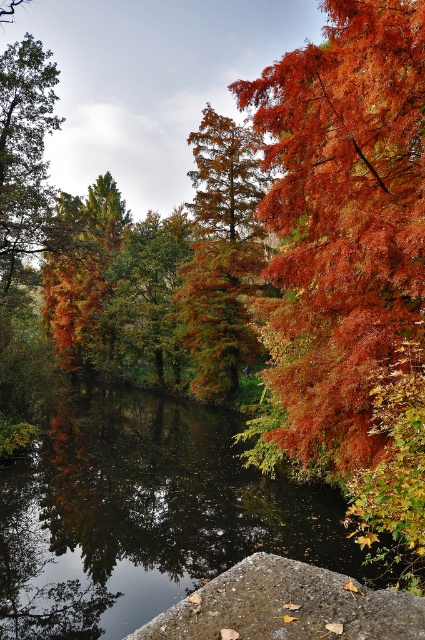
Between shiny orange leaves at right and smooth dark water at center, which one is positioned lower?

smooth dark water at center

Is point (377, 326) positioned after point (112, 404)?

No, (377, 326) is in front of (112, 404).

This screenshot has width=425, height=640. I want to click on shiny orange leaves at right, so click(342, 221).

Measure the distance between orange matte tree at center and camera.

The distance of orange matte tree at center from camera is 29.37 meters.

Which is above, orange matte tree at center or green matte tree at left?

green matte tree at left is higher up.

Does point (198, 381) come in front of point (31, 122)?

No.

This screenshot has width=425, height=640. I want to click on orange matte tree at center, so click(221, 253).

Is point (14, 490) positioned after point (48, 216)?

That is False.

Does smooth dark water at center appear on the right side of green matte tree at left?

Indeed, smooth dark water at center is positioned on the right side of green matte tree at left.

Is point (153, 557) farther from camera compared to point (5, 262)?

No.

You are a GUI agent. You are given a task and a screenshot of the screen. Output one action in this format:
    pyautogui.click(x=<x>, y=<y>)
    Task: Click on the smooth dark water at center
    This screenshot has width=425, height=640.
    Given the screenshot: What is the action you would take?
    pyautogui.click(x=141, y=513)